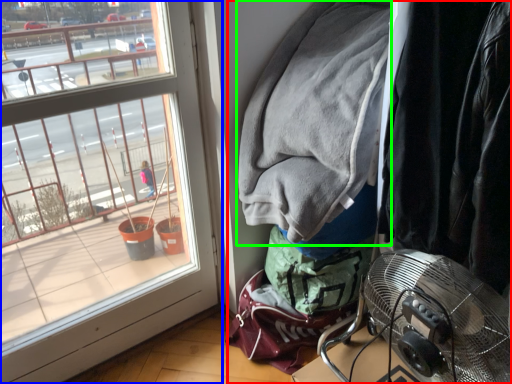
Question: Which object is the closest to the closet (highlighted by a red box)? Choose among these: window (highlighted by a blue box) or jacket (highlighted by a green box).

Choices:
 (A) window
 (B) jacket

Answer: (B)